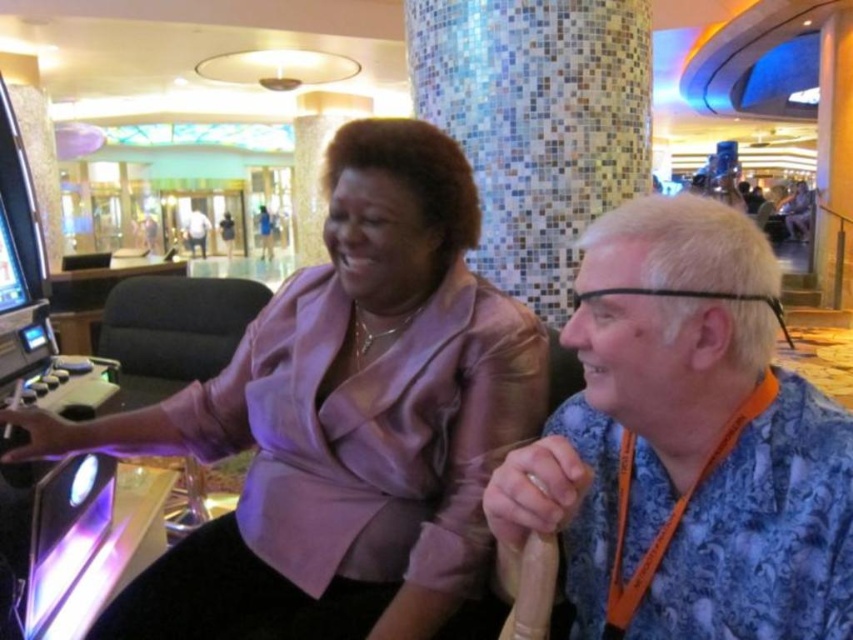
Question: Which object appears closest to the camera in this image?

Choices:
 (A) matte purple blouse at center
 (B) blue floral shirt at right

Answer: (B)

Question: Where is matte purple blouse at center located in relation to blue floral shirt at right in the image?

Choices:
 (A) left
 (B) right

Answer: (A)

Question: Is matte purple blouse at center bigger than blue floral shirt at right?

Choices:
 (A) no
 (B) yes

Answer: (B)

Question: Which of the following is the farthest from the observer?

Choices:
 (A) blue floral shirt at right
 (B) matte purple blouse at center

Answer: (B)

Question: Which point is farther from the camera taking this photo?

Choices:
 (A) (51, 444)
 (B) (824, 496)

Answer: (A)

Question: Does matte purple blouse at center have a larger size compared to blue floral shirt at right?

Choices:
 (A) yes
 (B) no

Answer: (A)